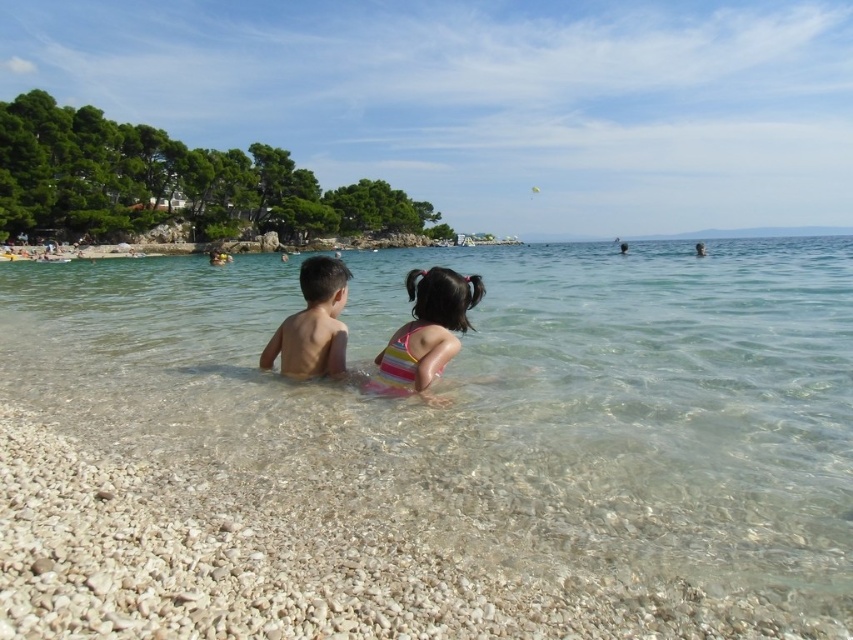
You are a photographer trying to capture a candid shot of the two children at the beach. You want to ensure the striped swimsuit at center and the naked skin boy at center are both in the frame. Based on their positions, which child should you focus on first to ensure both are captured?

The striped swimsuit at center is to the right of the naked skin boy at center, so focusing on the naked skin boy at center first will ensure the striped swimsuit at center is also captured to his right.

You are planning to take a photo of the clear water at center and the naked skin boy at center for a travel magazine. The editor requires the water area to be more prominent than the boy in the photo. Based on the scene description, will your current composition satisfy the editor?

The clear water at center is larger in size than the naked skin boy at center, so the current composition will satisfy the editor as the water area is more prominent.